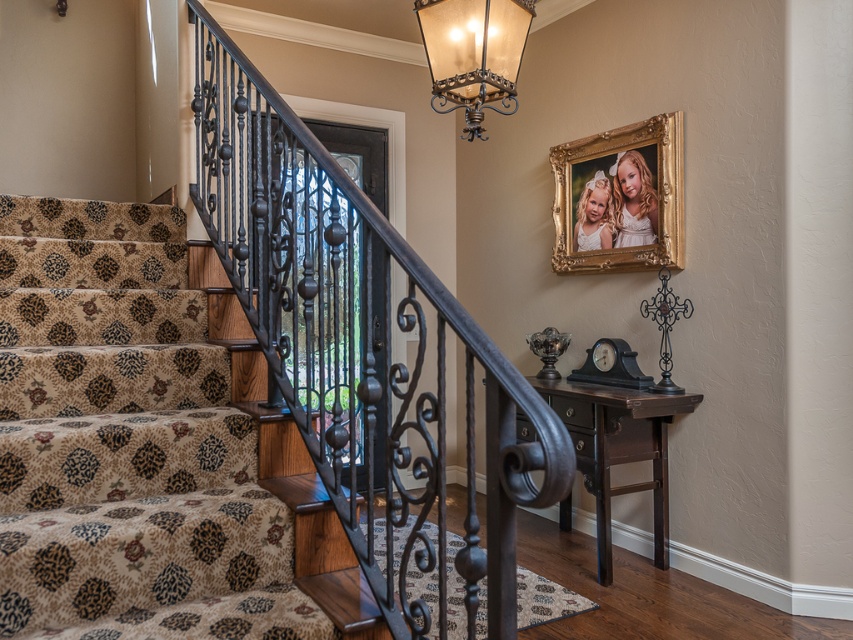
Question: Which point is closer to the camera?

Choices:
 (A) (285, 564)
 (B) (305, 161)
 (C) (654, 177)

Answer: (A)

Question: Which object appears closest to the camera in this image?

Choices:
 (A) metallic brass lantern at upper center
 (B) wrought iron railing at left
 (C) gold/gilded picture frame at upper center
 (D) patterned carpet at left

Answer: (B)

Question: Does wrought iron railing at left appear under gold/gilded picture frame at upper center?

Choices:
 (A) yes
 (B) no

Answer: (A)

Question: Is wrought iron railing at left bigger than metallic brass lantern at upper center?

Choices:
 (A) yes
 (B) no

Answer: (A)

Question: Is gold/gilded picture frame at upper center to the left of metallic brass lantern at upper center from the viewer's perspective?

Choices:
 (A) no
 (B) yes

Answer: (A)

Question: Which point is farther to the camera?

Choices:
 (A) [6, 317]
 (B) [543, 492]
 (C) [497, 8]

Answer: (C)